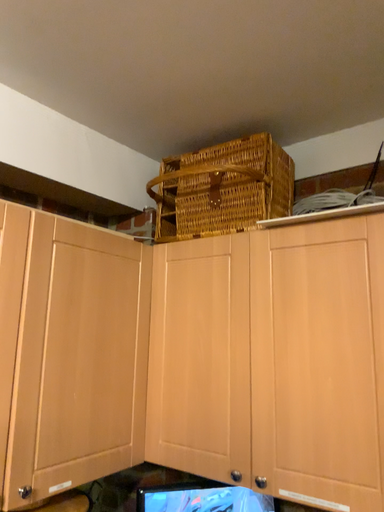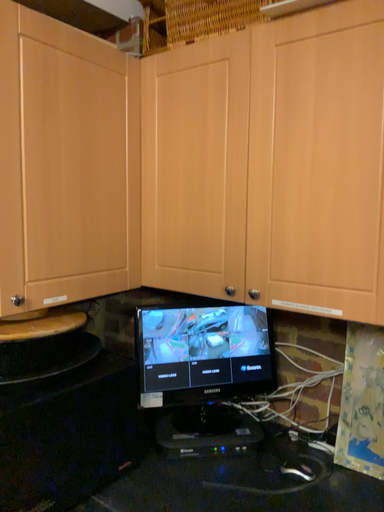
Question: Which way did the camera rotate in the video?

Choices:
 (A) rotated downward
 (B) rotated upward

Answer: (A)